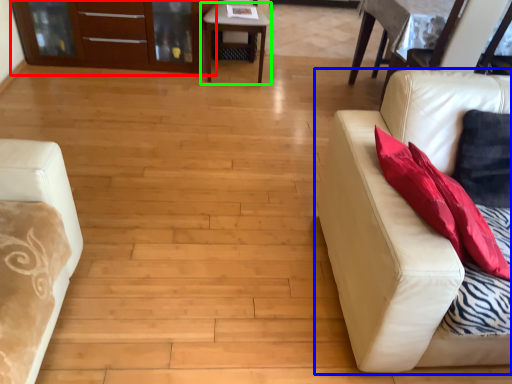
Question: Considering the real-world distances, which object is farthest from dresser (highlighted by a red box)? studio couch (highlighted by a blue box) or table (highlighted by a green box)?

Choices:
 (A) studio couch
 (B) table

Answer: (A)